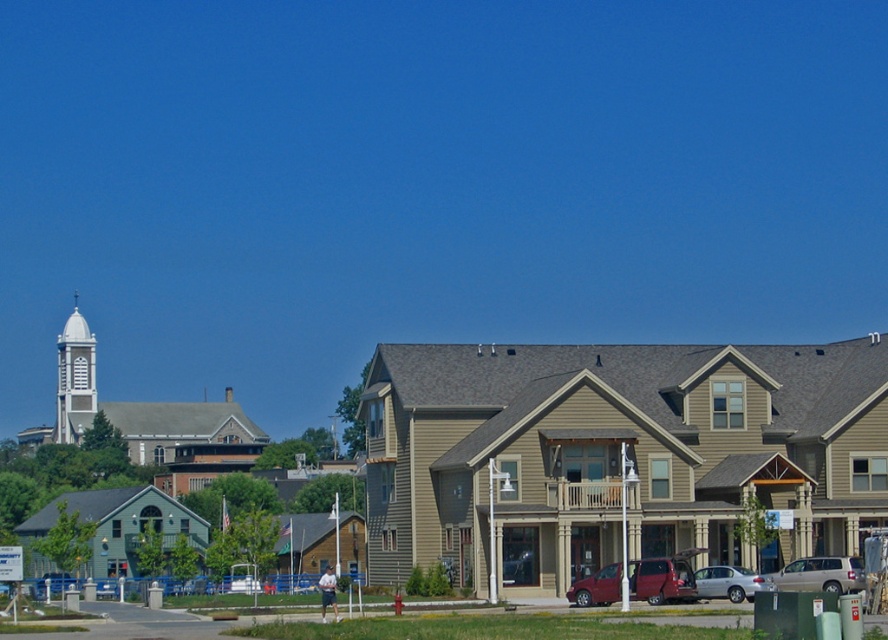
Can you confirm if white stucco spire at upper left is positioned to the right of silver metallic sedan at lower right?

No, white stucco spire at upper left is not to the right of silver metallic sedan at lower right.

Can you confirm if white stucco spire at upper left is smaller than silver metallic sedan at lower right?

Actually, white stucco spire at upper left might be larger than silver metallic sedan at lower right.

Measure the distance between white stucco spire at upper left and camera.

700.03 feet

I want to click on white stucco spire at upper left, so click(x=74, y=378).

Does silver metallic minivan at lower right come in front of silver metallic sedan at lower right?

Yes, silver metallic minivan at lower right is in front of silver metallic sedan at lower right.

Consider the image. Between silver metallic minivan at lower right and silver metallic sedan at lower right, which one appears on the left side from the viewer's perspective?

Positioned to the left is silver metallic sedan at lower right.

Identify the location of silver metallic minivan at lower right. This screenshot has width=888, height=640. (821, 573).

Is metallic maroon van at center to the right of silver metallic sedan at lower right from the viewer's perspective?

No, metallic maroon van at center is not to the right of silver metallic sedan at lower right.

Which is behind, point (601, 586) or point (696, 586)?

Positioned behind is point (696, 586).

Find the location of a particular element. metallic maroon van at center is located at coordinates (661, 579).